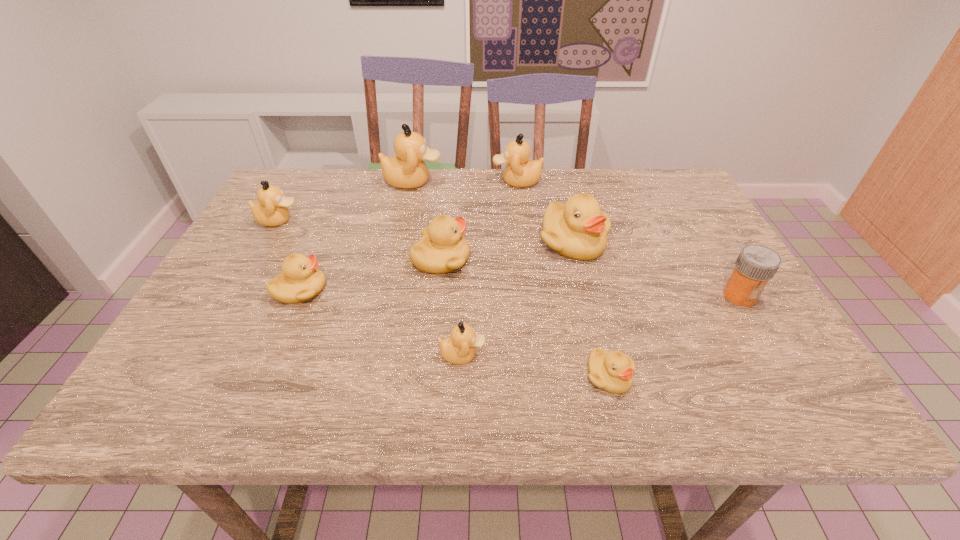
The image size is (960, 540). What are the coordinates of `vacant space at the left edge of the desktop` in the screenshot? It's located at (265, 296).

In the image, there is a desktop. Where is `vacant space at the right edge`? vacant space at the right edge is located at coordinates (722, 247).

The height and width of the screenshot is (540, 960). I want to click on vacant space at the far right corner of the desktop, so click(x=661, y=206).

Identify the location of free space at the near right corner. (780, 408).

Where is `empty location between the orange medicine and the third tan duckling from left to right`? empty location between the orange medicine and the third tan duckling from left to right is located at coordinates (601, 325).

Locate an element on the screen. free space between the tallest duckling and the shortest object is located at coordinates (511, 279).

Identify the location of vacant area that lies between the tallest duckling and the shortest duckling. (511, 279).

Where is `free space between the biggest yellow duckling and the second tan duckling from left to right`? This screenshot has height=540, width=960. free space between the biggest yellow duckling and the second tan duckling from left to right is located at coordinates (492, 212).

Find the location of `free space between the rightmost tan duckling and the tallest object`. free space between the rightmost tan duckling and the tallest object is located at coordinates (465, 181).

Find the location of a particular element. free point between the third smallest yellow duckling and the seventh duckling from right to left is located at coordinates (371, 274).